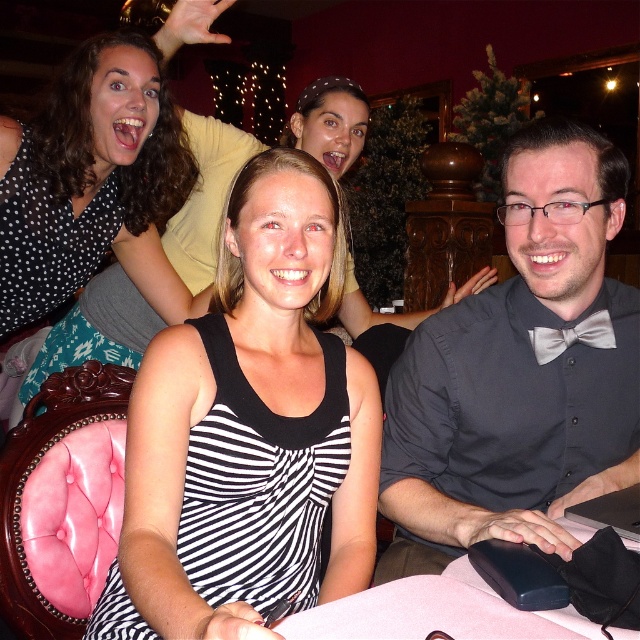
You are planning to take a photo of the black striped dress at center. To ensure it is in the frame, where should you position the camera relative to the other objects in the scene?

The black striped dress at center is located at point (250, 429), so position the camera to focus on that coordinate to include it in the frame.

You are a photographer trying to capture a closeup shot of the matte gray bow tie at center and the polka dot blouse at upper left. Since your camera can only focus on one object at a time, which object should you choose to ensure it appears larger in the photo?

The matte gray bow tie at center is bigger than the polka dot blouse at upper left, so you should choose the matte gray bow tie at center to ensure it appears larger in the photo.